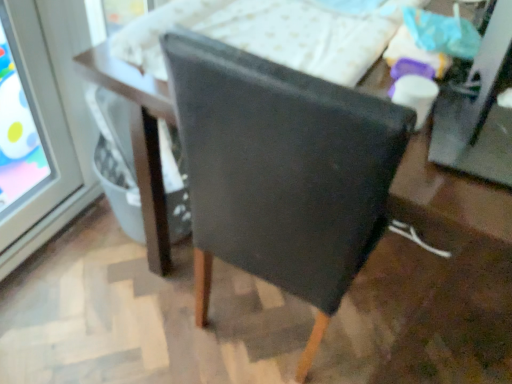
Find the location of `free space in front of matte black table at center`. free space in front of matte black table at center is located at coordinates (92, 278).